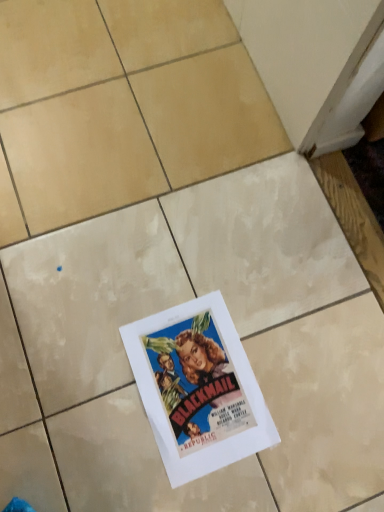
What do you see at coordinates (197, 388) in the screenshot? This screenshot has width=384, height=512. I see `matte paper poster at center` at bounding box center [197, 388].

This screenshot has height=512, width=384. In order to click on matte paper poster at center in this screenshot , I will do `click(197, 388)`.

Where is `matte paper poster at center`? matte paper poster at center is located at coordinates (197, 388).